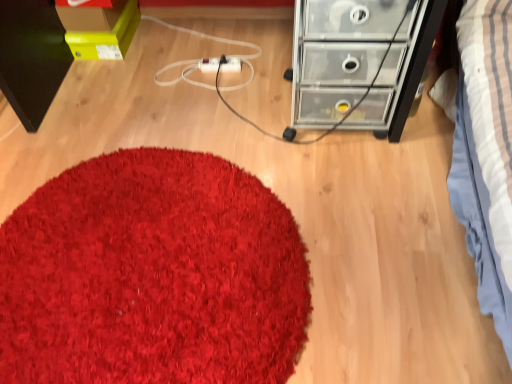
I want to click on vacant space behind shaggy red carpet at center, so click(x=173, y=89).